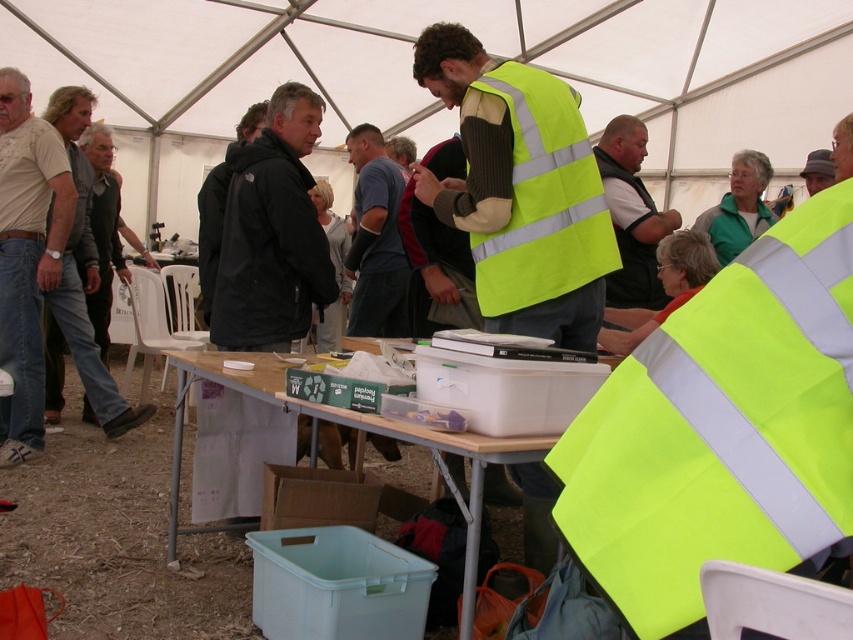
Question: Which object appears farthest from the camera in this image?

Choices:
 (A) matte black vest at center
 (B) matte beige t-shirt at left
 (C) black matte jacket at center

Answer: (B)

Question: Which point is farther to the camera?

Choices:
 (A) (48, 275)
 (B) (535, 124)
 (C) (305, 268)
 (D) (614, 234)

Answer: (A)

Question: Which object is positioned closest to the dark blue t-shirt at center?

Choices:
 (A) neon yellow reflective vest at center
 (B) black matte jacket at center

Answer: (B)

Question: Is dark blue t-shirt at center wider than dark gray fabric cap at upper right?

Choices:
 (A) yes
 (B) no

Answer: (A)

Question: Does matte beige t-shirt at left appear under wooden table at center?

Choices:
 (A) no
 (B) yes

Answer: (A)

Question: Does neon yellow reflective vest at center appear under black matte jacket at center?

Choices:
 (A) yes
 (B) no

Answer: (B)